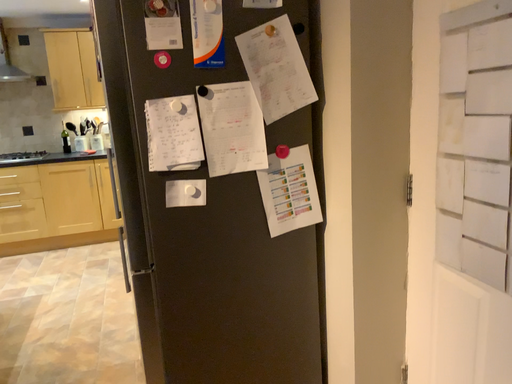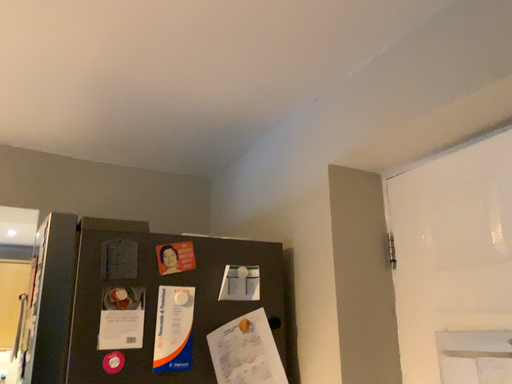
Question: How did the camera likely rotate when shooting the video?

Choices:
 (A) rotated right
 (B) rotated left

Answer: (A)